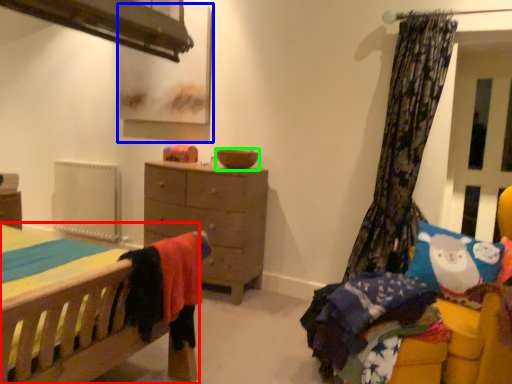
Question: Estimate the real-world distances between objects in this image. Which object is closer to bed (highlighted by a red box), picture frame (highlighted by a blue box) or bowl (highlighted by a green box)?

Choices:
 (A) picture frame
 (B) bowl

Answer: (B)